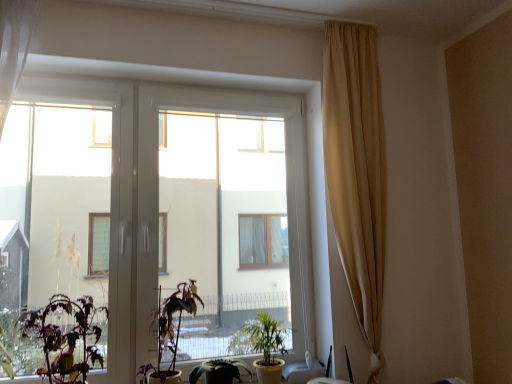
Where is `transparent glass window at center`? transparent glass window at center is located at coordinates (158, 198).

This screenshot has height=384, width=512. Describe the element at coordinates (263, 345) in the screenshot. I see `green matte plant at center, marked as the first houseplant in a right-to-left arrangement` at that location.

The height and width of the screenshot is (384, 512). Find the location of `purple matte plant at center, which is the third houseplant from right to left`. purple matte plant at center, which is the third houseplant from right to left is located at coordinates (170, 332).

Consider the image. Could you tell me if green matte plant at lower left, positioned as the 4th houseplant in right-to-left order, is turned towards beige fabric curtain at right?

No, green matte plant at lower left, positioned as the 4th houseplant in right-to-left order, is not oriented towards beige fabric curtain at right.

From their relative heights in the image, would you say green matte plant at lower left, which ranks as the first houseplant in left-to-right order, is taller or shorter than beige fabric curtain at right?

green matte plant at lower left, which ranks as the first houseplant in left-to-right order, is shorter than beige fabric curtain at right.

In terms of size, does green matte plant at lower center, the second houseplant viewed from the right, appear bigger or smaller than beige fabric curtain at right?

Considering their sizes, green matte plant at lower center, the second houseplant viewed from the right, takes up less space than beige fabric curtain at right.

Would you say green matte plant at lower center, the second houseplant viewed from the right, contains beige fabric curtain at right?

Actually, beige fabric curtain at right is outside green matte plant at lower center, the second houseplant viewed from the right.

Consider the image. Is green matte plant at lower center, which ranks as the 3th houseplant in left-to-right order, facing towards beige fabric curtain at right?

No, green matte plant at lower center, which ranks as the 3th houseplant in left-to-right order, is not facing towards beige fabric curtain at right.

Between green matte plant at lower center, which ranks as the 3th houseplant in left-to-right order, and beige fabric curtain at right, which one has less height?

green matte plant at lower center, which ranks as the 3th houseplant in left-to-right order, is shorter.

In terms of height, does beige fabric curtain at right look taller or shorter compared to green matte plant at lower center, which ranks as the 3th houseplant in left-to-right order?

Clearly, beige fabric curtain at right is taller compared to green matte plant at lower center, which ranks as the 3th houseplant in left-to-right order.

Which point is more distant from viewer, [374,198] or [206,361]?

The point [374,198] is more distant.

From a real-world perspective, does beige fabric curtain at right sit lower than green matte plant at lower center, the second houseplant viewed from the right?

No, from a real-world perspective, beige fabric curtain at right is not beneath green matte plant at lower center, the second houseplant viewed from the right.

Considering the relative sizes of green matte plant at lower left, which ranks as the first houseplant in left-to-right order, and green matte plant at center, positioned as the 4th houseplant in left-to-right order, in the image provided, is green matte plant at lower left, which ranks as the first houseplant in left-to-right order, thinner than green matte plant at center, positioned as the 4th houseplant in left-to-right order,?

Indeed, green matte plant at lower left, which ranks as the first houseplant in left-to-right order, has a lesser width compared to green matte plant at center, positioned as the 4th houseplant in left-to-right order.

From the picture: Could you tell me if green matte plant at lower left, which ranks as the first houseplant in left-to-right order, is turned towards green matte plant at center, marked as the first houseplant in a right-to-left arrangement?

No, green matte plant at lower left, which ranks as the first houseplant in left-to-right order, is not facing towards green matte plant at center, marked as the first houseplant in a right-to-left arrangement.

Which is correct: green matte plant at lower left, which ranks as the first houseplant in left-to-right order, is inside green matte plant at center, positioned as the 4th houseplant in left-to-right order, or outside of it?

green matte plant at lower left, which ranks as the first houseplant in left-to-right order, is not enclosed by green matte plant at center, positioned as the 4th houseplant in left-to-right order.

Is transparent glass window at center wider than purple matte plant at center, which is the third houseplant from right to left?

In fact, transparent glass window at center might be narrower than purple matte plant at center, which is the third houseplant from right to left.

How distant is transparent glass window at center from purple matte plant at center, which is counted as the 2th houseplant, starting from the left?

transparent glass window at center is 41.15 centimeters from purple matte plant at center, which is counted as the 2th houseplant, starting from the left.

From a real-world perspective, between transparent glass window at center and purple matte plant at center, which is counted as the 2th houseplant, starting from the left, who is vertically higher?

In real-world perspective, transparent glass window at center is above.

Is transparent glass window at center located within green matte plant at lower center, the second houseplant viewed from the right?

Definitely not — transparent glass window at center is not inside green matte plant at lower center, the second houseplant viewed from the right.

What's the angular difference between green matte plant at lower center, which ranks as the 3th houseplant in left-to-right order, and transparent glass window at center's facing directions?

There is a 1.82-degree angle between the facing directions of green matte plant at lower center, which ranks as the 3th houseplant in left-to-right order, and transparent glass window at center.

Which object is thinner, green matte plant at lower center, which ranks as the 3th houseplant in left-to-right order, or transparent glass window at center?

green matte plant at lower center, which ranks as the 3th houseplant in left-to-right order.

In terms of height, does transparent glass window at center look taller or shorter compared to beige fabric curtain at right?

transparent glass window at center is shorter than beige fabric curtain at right.

From the image's perspective, between transparent glass window at center and beige fabric curtain at right, which one is located above?

beige fabric curtain at right, from the image's perspective.

Is beige fabric curtain at right at the back of transparent glass window at center?

No.

You are a GUI agent. You are given a task and a screenshot of the screen. Output one action in this format:
    pyautogui.click(x=<x>, y=<y>)
    Task: Click on the curtain that is on the right side of green matte plant at lower left, which ranks as the first houseplant in left-to-right order
    Image resolution: width=512 pixels, height=384 pixels.
    Given the screenshot: What is the action you would take?
    pyautogui.click(x=357, y=171)

I want to click on curtain located above the green matte plant at lower center, the second houseplant viewed from the right (from a real-world perspective), so click(357, 171).

When comparing their distances from green matte plant at lower center, which ranks as the 3th houseplant in left-to-right order, does green matte plant at center, marked as the first houseplant in a right-to-left arrangement, or beige fabric curtain at right seem further?

beige fabric curtain at right.

Considering their positions, is green matte plant at lower left, positioned as the 4th houseplant in right-to-left order, positioned closer to green matte plant at center, marked as the first houseplant in a right-to-left arrangement, than beige fabric curtain at right?

green matte plant at lower left, positioned as the 4th houseplant in right-to-left order, is closer to green matte plant at center, marked as the first houseplant in a right-to-left arrangement.

Based on their spatial positions, is green matte plant at lower center, the second houseplant viewed from the right, or beige fabric curtain at right further from purple matte plant at center, which is counted as the 2th houseplant, starting from the left?

beige fabric curtain at right.

Looking at the image, which one is located closer to purple matte plant at center, which is counted as the 2th houseplant, starting from the left, transparent glass window at center or beige fabric curtain at right?

transparent glass window at center.

From the image, which object appears to be farther from green matte plant at center, marked as the first houseplant in a right-to-left arrangement, green matte plant at lower center, which ranks as the 3th houseplant in left-to-right order, or transparent glass window at center?

transparent glass window at center is positioned further to the anchor green matte plant at center, marked as the first houseplant in a right-to-left arrangement.

When comparing their distances from purple matte plant at center, which is counted as the 2th houseplant, starting from the left, does beige fabric curtain at right or green matte plant at center, marked as the first houseplant in a right-to-left arrangement, seem further?

Among the two, beige fabric curtain at right is located further to purple matte plant at center, which is counted as the 2th houseplant, starting from the left.

Looking at this image, which object lies further to the anchor point transparent glass window at center, green matte plant at center, marked as the first houseplant in a right-to-left arrangement, or green matte plant at lower center, the second houseplant viewed from the right?

green matte plant at lower center, the second houseplant viewed from the right.

Looking at this image, which object lies nearer to the anchor point green matte plant at lower left, positioned as the 4th houseplant in right-to-left order, transparent glass window at center or green matte plant at center, positioned as the 4th houseplant in left-to-right order?

transparent glass window at center is closer to green matte plant at lower left, positioned as the 4th houseplant in right-to-left order.

Where is `houseplant between transparent glass window at center and green matte plant at lower left, positioned as the 4th houseplant in right-to-left order, in the vertical direction`? houseplant between transparent glass window at center and green matte plant at lower left, positioned as the 4th houseplant in right-to-left order, in the vertical direction is located at coordinates (170, 332).

I want to click on window between purple matte plant at center, which is the third houseplant from right to left, and beige fabric curtain at right, in the horizontal direction, so click(158, 198).

Identify the location of window situated between green matte plant at lower left, positioned as the 4th houseplant in right-to-left order, and green matte plant at center, positioned as the 4th houseplant in left-to-right order, from left to right. (158, 198).

At what (x,y) coordinates should I click in order to perform the action: click on houseplant between purple matte plant at center, which is counted as the 2th houseplant, starting from the left, and green matte plant at center, positioned as the 4th houseplant in left-to-right order, in the horizontal direction. Please return your answer as a coordinate pair (x, y). Looking at the image, I should click on (219, 371).